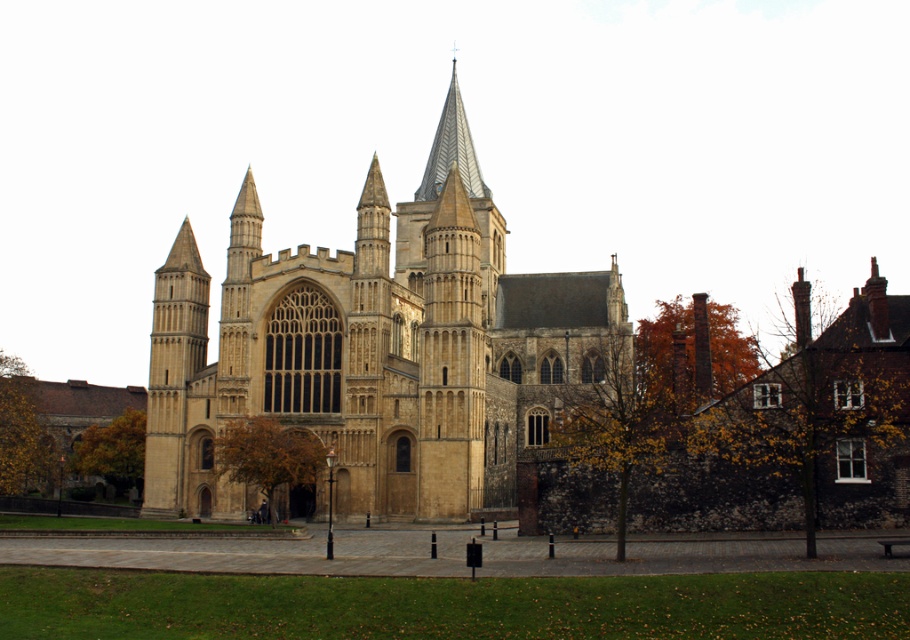
From the picture: You are an artist planning to paint the cathedral scene. You want to ensure the orange autumn leaves at right and the brown leafy tree at center are proportionally accurate. Which object should you make wider in your painting?

You should make the orange autumn leaves at right wider because their width is larger than the brown leafy tree at center.